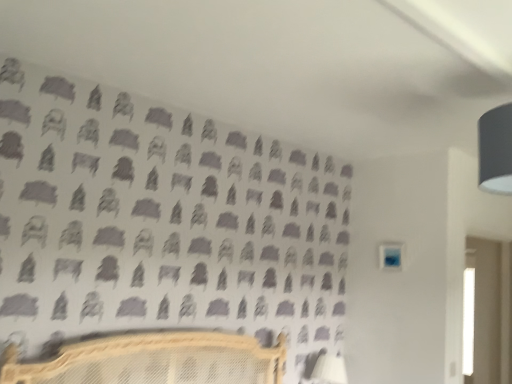
Find the location of a particular element. white fabric lampshade at lower right is located at coordinates (329, 370).

Describe the element at coordinates (329, 370) in the screenshot. I see `white fabric lampshade at lower right` at that location.

What is the approximate height of white fabric lampshade at lower right?

The height of white fabric lampshade at lower right is 9.58 inches.

Find the location of a particular element. Image resolution: width=512 pixels, height=384 pixels. white fabric lampshade at lower right is located at coordinates pyautogui.click(x=329, y=370).